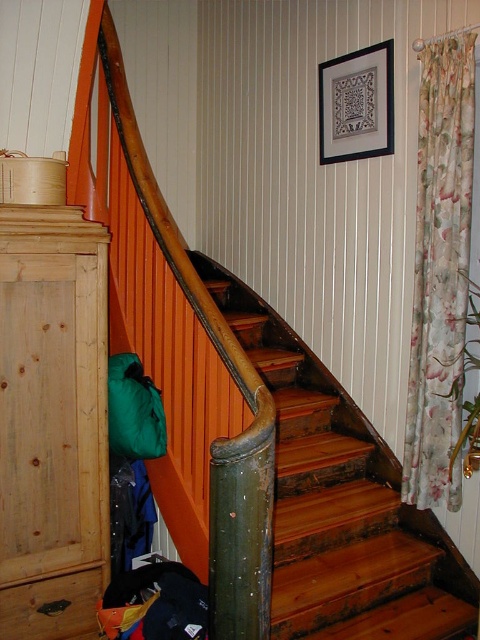
You are standing at the bottom of the wooden stairs at center and want to reach the floral fabric curtain at right. Which direction should you move to get closer to the curtain?

The wooden stairs at center is to the left of the floral fabric curtain at right, so you should move to your right to get closer to the curtain.

You are standing at the bottom of the wooden stairs at center and want to climb up. How many steps do you need to take to reach the top?

The wooden stairs at center have 12 steps in total, so you need to take 12 steps to reach the top.

You are a delivery person trying to place a package on the floor between the wooden stairs at center and the green fabric sleeping bag at lower left. The package is 30 inches long. Will it fit in the space between them?

The space between the wooden stairs at center and the green fabric sleeping bag at lower left is 32.09 inches. Since the package is 30 inches long, it will fit as the space is slightly larger than the package.